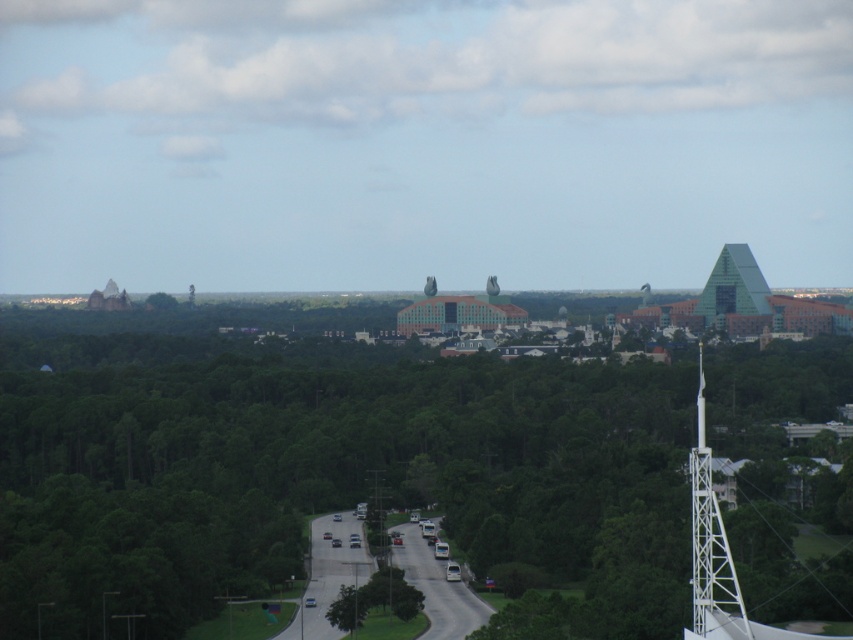
Question: Which object is closer to the camera taking this photo?

Choices:
 (A) green glass pyramid at upper right
 (B) white metallic tower at right
 (C) green leafy tree at lower center
 (D) green leafy tree at center

Answer: (D)

Question: Can you confirm if green leafy tree at center is positioned below green leafy tree at lower center?

Choices:
 (A) no
 (B) yes

Answer: (A)

Question: Can you confirm if white metallic tower at right is bigger than green glass pyramid at upper right?

Choices:
 (A) no
 (B) yes

Answer: (B)

Question: Which object appears farthest from the camera in this image?

Choices:
 (A) green glass pyramid at upper right
 (B) green leafy tree at center

Answer: (A)

Question: Which point appears closest to the camera in this image?

Choices:
 (A) (415, 596)
 (B) (738, 627)
 (C) (521, 419)
 (D) (763, 291)

Answer: (C)

Question: Does green glass pyramid at upper right appear on the left side of green leafy tree at lower center?

Choices:
 (A) no
 (B) yes

Answer: (A)